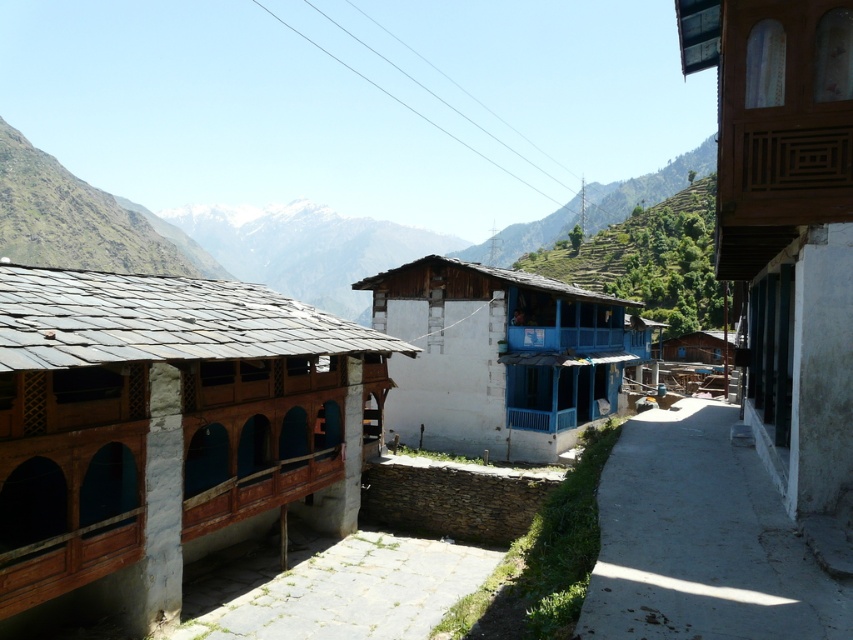
You are a hiker who has just arrived at the village. You notice a wooden balcony at right and a green grassy hillside at center. Which of these two features is taller?

The wooden balcony at right is shorter than the green grassy hillside at center, so the green grassy hillside at center is taller.

You are a hiker who wants to set up a tent. You have two options for the campsite location near the center of the image. One is the concrete at center and the other is the green grassy hillside at center. Based on their sizes, which location would provide more space for your tent?

The green grassy hillside at center is larger than the concrete at center, so it would provide more space for your tent.

You are standing in the village and want to walk to the green grassy hillside at center. Which direction should you move relative to the concrete at center?

Since the concrete at center is closer to the viewer than the green grassy hillside at center, you should move forward away from the concrete at center to reach the green grassy hillside at center.